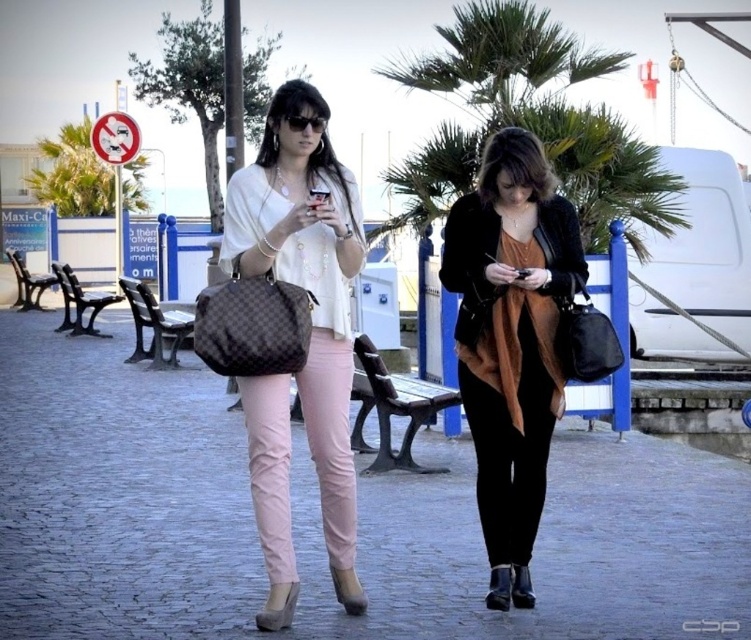
You are a photographer standing at the end of the promenade. You want to take a photo that includes both the matte black handbag at center and the green leafy palm tree at upper left. Which object should you focus on first to ensure both are in sharp focus?

The matte black handbag at center is closer to the viewer than the green leafy palm tree at upper left, so you should focus on the matte black handbag at center first to ensure both are in sharp focus.

You are a photographer standing at the point labeled point (318, 196). You want to take a photo of the two women walking on the promenade. Which woman is closer to your current position?

The point labeled point (318, 196) corresponds to the matte black smartphone at center, so the woman holding the matte black smartphone at center is closer to your position.